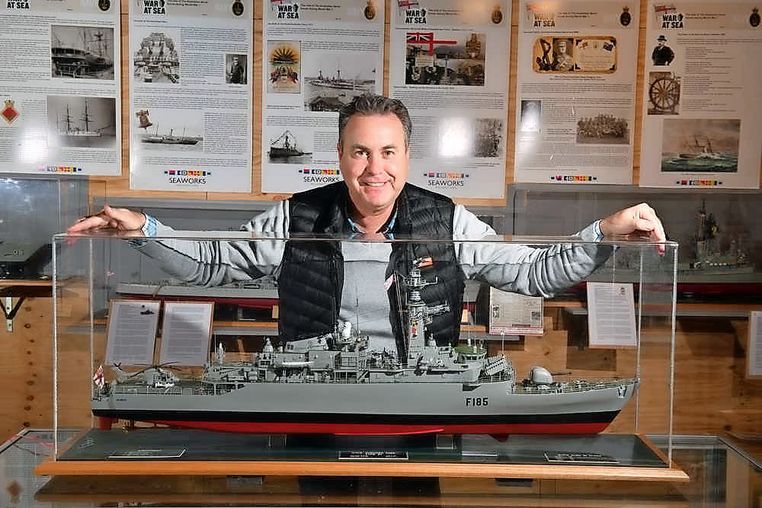
Image resolution: width=762 pixels, height=508 pixels. I want to click on wooden bottom of glass encasing, so click(x=66, y=468), click(x=651, y=475).